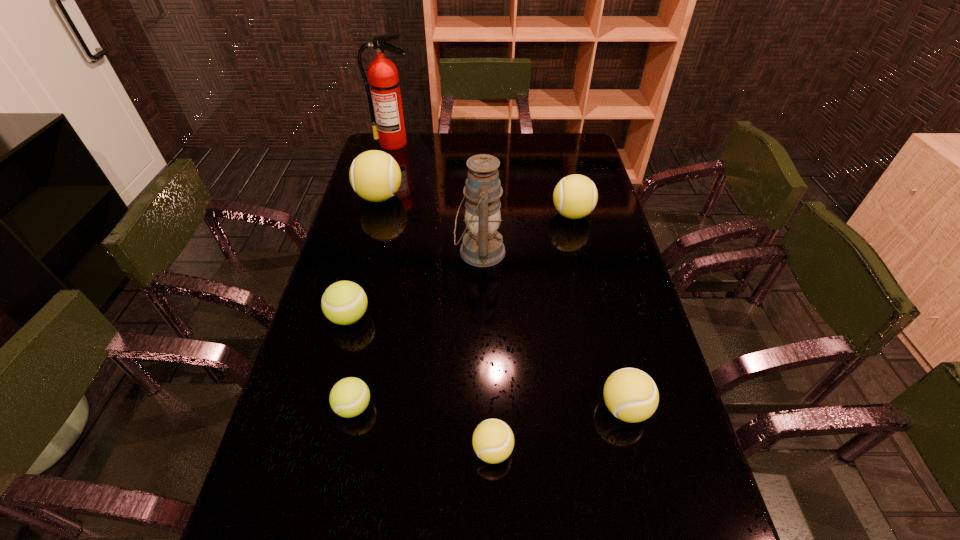
The image size is (960, 540). Identify the location of vacant region located 0.180m on the left of the third yellow tennis ball from right to left. (391, 450).

What are the coordinates of `free space located 0.150m on the right of the smaller green tennis ball` in the screenshot? It's located at (436, 407).

Locate an element on the screen. object located at the far edge is located at coordinates (384, 83).

In order to click on fire extinguisher that is at the left edge in this screenshot , I will do point(384,83).

Image resolution: width=960 pixels, height=540 pixels. In order to click on object situated at the far left corner in this screenshot , I will do `click(384, 83)`.

At what (x,y) coordinates should I click in order to perform the action: click on vacant region at the far edge of the desktop. Please return your answer as a coordinate pair (x, y). The height and width of the screenshot is (540, 960). Looking at the image, I should click on (434, 136).

Locate an element on the screen. The width and height of the screenshot is (960, 540). blank area at the left edge is located at coordinates (341, 351).

I want to click on vacant space at the right edge of the desktop, so click(685, 470).

Where is `free space at the far left corner of the desktop`? This screenshot has width=960, height=540. free space at the far left corner of the desktop is located at coordinates (405, 150).

The image size is (960, 540). In order to click on vacant region at the far right corner in this screenshot , I will do `click(581, 152)`.